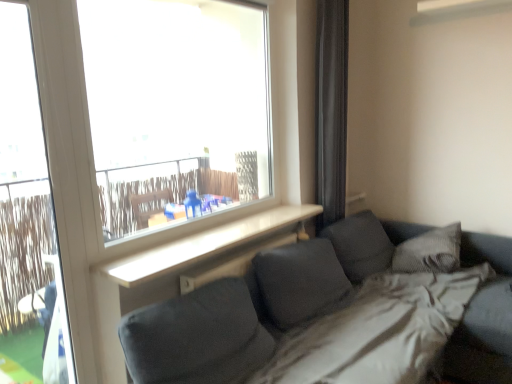
Question: Considering the relative sizes of white plastic screen door at left and textured gray pillow at right in the image provided, is white plastic screen door at left shorter than textured gray pillow at right?

Choices:
 (A) yes
 (B) no

Answer: (B)

Question: From the image's perspective, is white plastic screen door at left located beneath textured gray pillow at right?

Choices:
 (A) yes
 (B) no

Answer: (B)

Question: Is white plastic screen door at left positioned beyond the bounds of textured gray pillow at right?

Choices:
 (A) yes
 (B) no

Answer: (A)

Question: Is textured gray pillow at right surrounded by white plastic screen door at left?

Choices:
 (A) yes
 (B) no

Answer: (B)

Question: Could you tell me if white plastic screen door at left is facing textured gray pillow at right?

Choices:
 (A) yes
 (B) no

Answer: (B)

Question: Would you consider white plastic screen door at left to be distant from textured gray pillow at right?

Choices:
 (A) yes
 (B) no

Answer: (A)

Question: Does black fabric curtain at right appear on the right side of textured gray pillow at right?

Choices:
 (A) yes
 (B) no

Answer: (B)

Question: From a real-world perspective, is black fabric curtain at right physically above textured gray pillow at right?

Choices:
 (A) yes
 (B) no

Answer: (A)

Question: Is black fabric curtain at right shorter than textured gray pillow at right?

Choices:
 (A) no
 (B) yes

Answer: (A)

Question: Does black fabric curtain at right have a smaller size compared to textured gray pillow at right?

Choices:
 (A) no
 (B) yes

Answer: (A)

Question: Can we say black fabric curtain at right lies outside textured gray pillow at right?

Choices:
 (A) no
 (B) yes

Answer: (B)

Question: Can you confirm if black fabric curtain at right is taller than textured gray pillow at right?

Choices:
 (A) yes
 (B) no

Answer: (A)

Question: Considering the relative sizes of white plastic screen door at left and black fabric curtain at right in the image provided, is white plastic screen door at left wider than black fabric curtain at right?

Choices:
 (A) no
 (B) yes

Answer: (B)